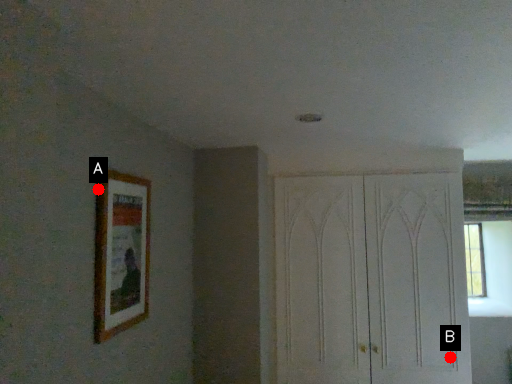
Question: Two points are circled on the image, labeled by A and B beside each circle. Which point appears closest to the camera in this image?

Choices:
 (A) A is closer
 (B) B is closer

Answer: (A)